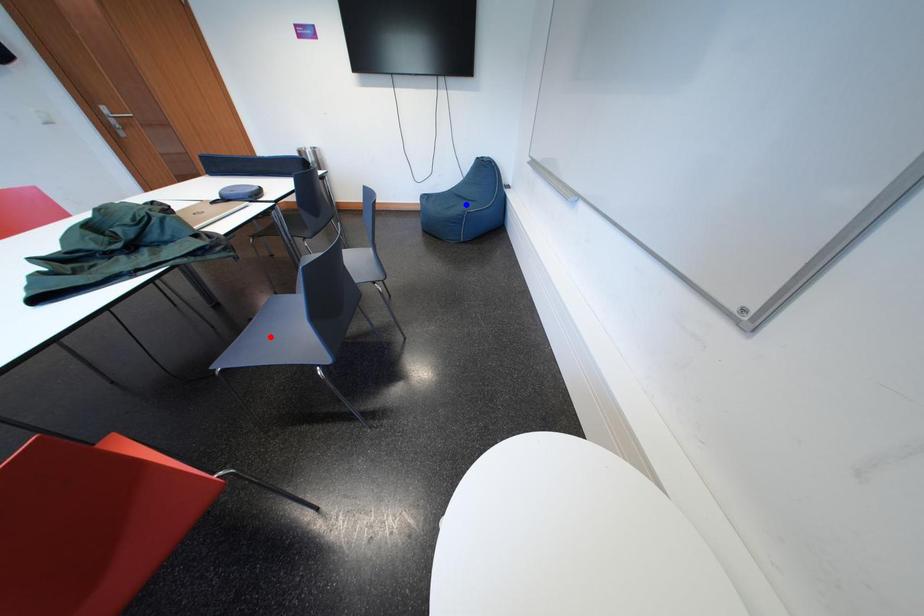
Question: Two points are marked on the image. Which point is closer to the camera?

Choices:
 (A) Blue point is closer.
 (B) Red point is closer.

Answer: (B)